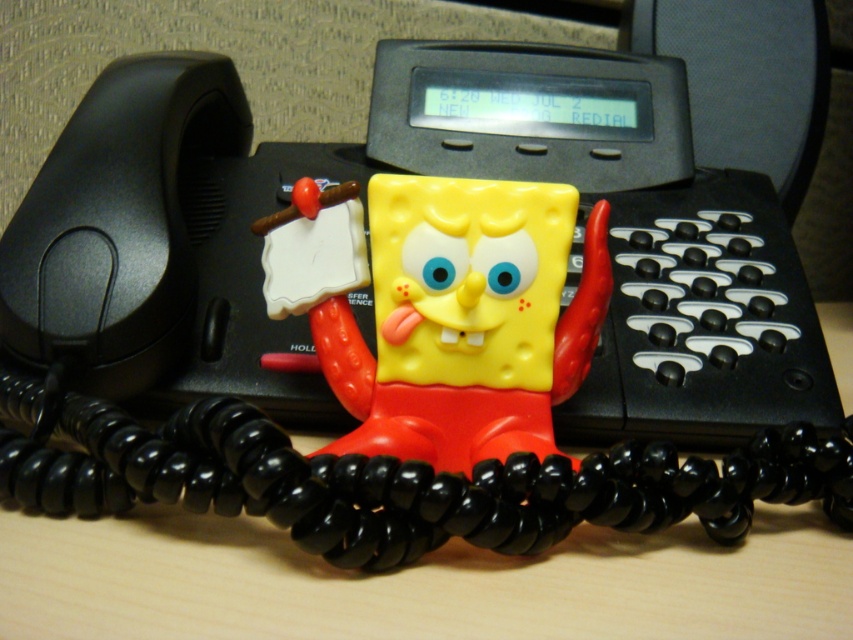
You are a delivery robot with a 15 cm wide package. You need to move the package from the black plastic phone at center to the yellow matte sponge at center. Is the space between them wide enough for the package?

The distance between the black plastic phone at center and the yellow matte sponge at center is 16.25 centimeters, so yes, the space is wide enough for a 15 cm wide package.

What are the coordinates of the black plastic phone at center?

The coordinates of the black plastic phone at center are at point (x=165, y=243).